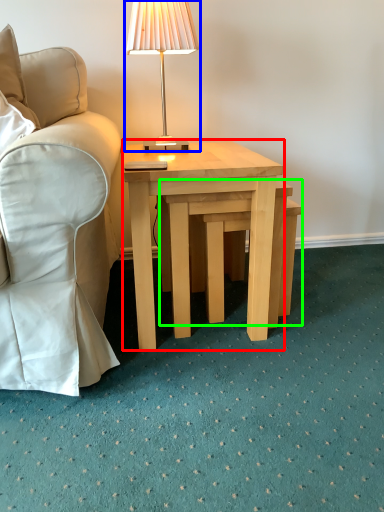
Question: Based on their relative distances, which object is farther from coffee table (highlighted by a red box)? Choose from lamp (highlighted by a blue box) and step stool (highlighted by a green box).

Choices:
 (A) lamp
 (B) step stool

Answer: (A)